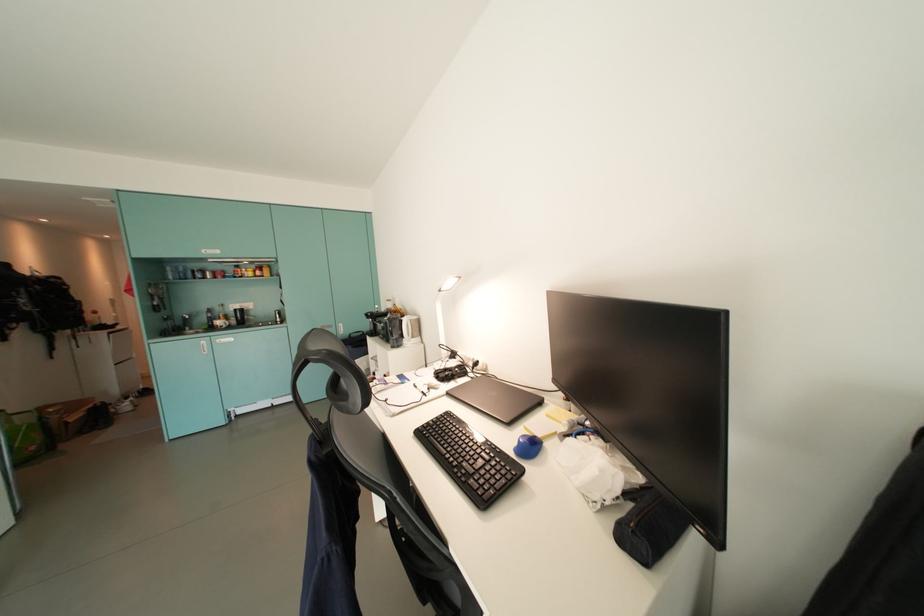
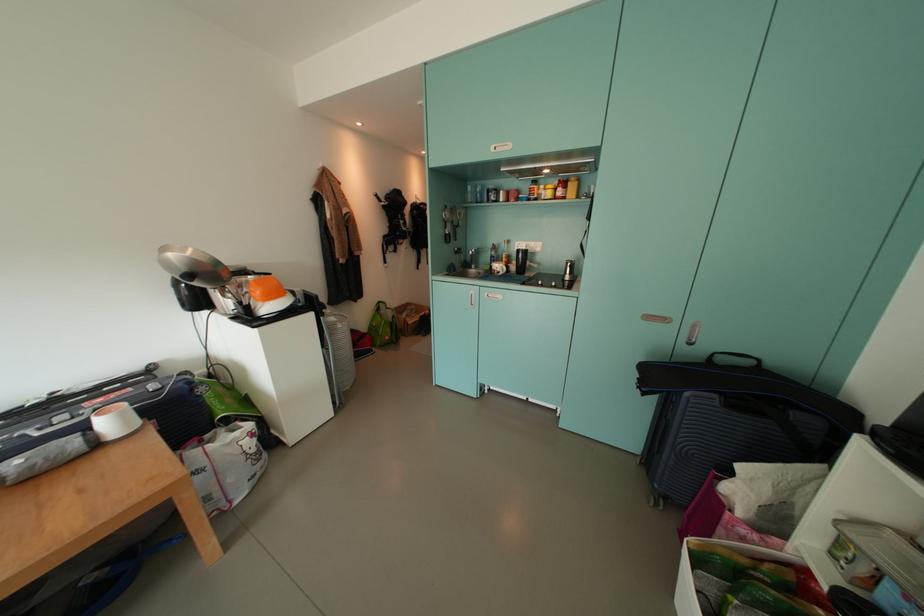
In the second image, find the point that corresponds to (187,326) in the first image.

(477, 261)